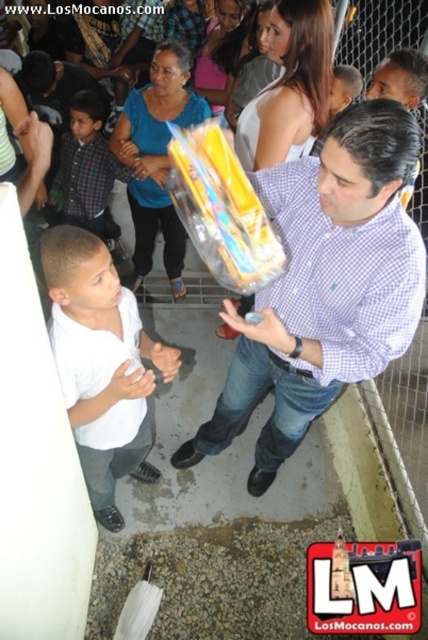
You are organizing a small event and need to place the matte plastic toy at center and the plaid fabric shirt at left on a shelf. Since the shelf has limited space, which object should you place first to ensure both fit properly?

The plaid fabric shirt at left should be placed first because the matte plastic toy at center is larger and requires more space, so starting with the smaller item ensures both can fit on the shelf.

You are standing at the front of the stage and want to hand the matte plastic toy at center to a child who is 4 feet away from you. Can you reach the child without moving from your current position?

The matte plastic toy at center is 3.84 feet away from the viewer. Since the child is 4 feet away, which is slightly farther than the toy, you may need to extend your arm or take a small step forward to reach them.